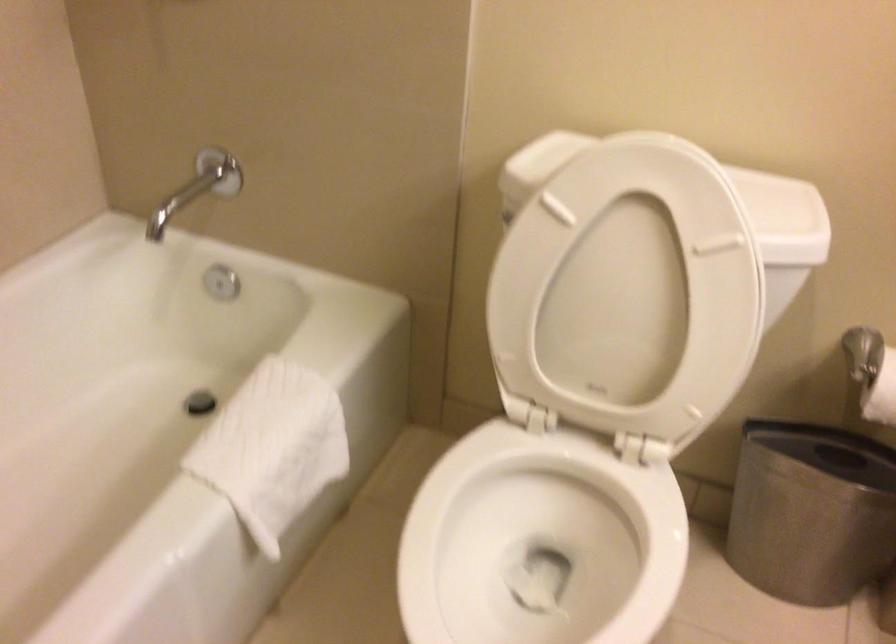
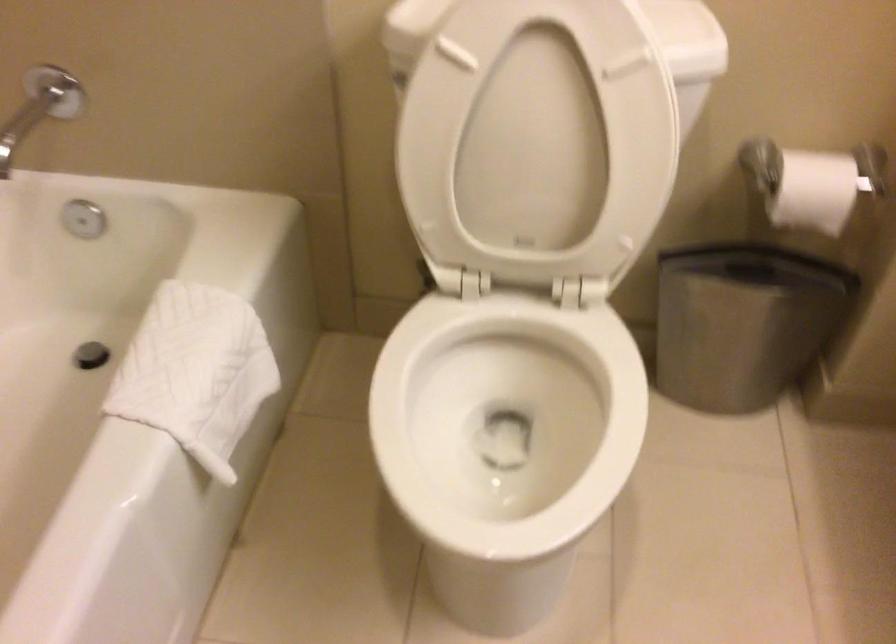
Where in the second image is the point corresponding to (x=819, y=512) from the first image?

(743, 323)